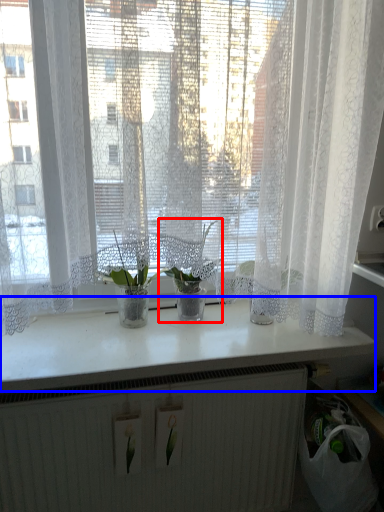
Question: Which object is further to the camera taking this photo, houseplant (highlighted by a red box) or counter top (highlighted by a blue box)?

Choices:
 (A) houseplant
 (B) counter top

Answer: (A)